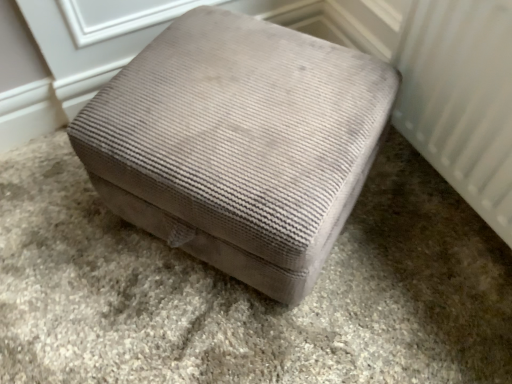
The width and height of the screenshot is (512, 384). Identify the location of free space in front of velvet ottoman at center. (231, 336).